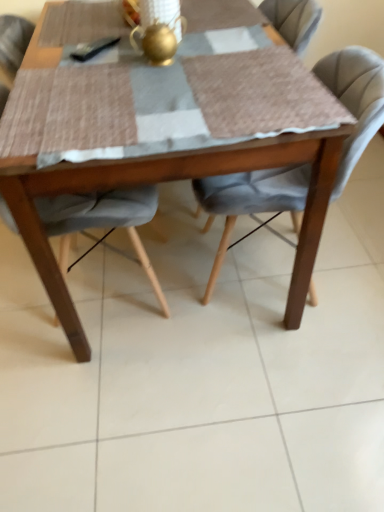
Where is `free spot in front of gold metallic teapot at center`? The image size is (384, 512). free spot in front of gold metallic teapot at center is located at coordinates (160, 88).